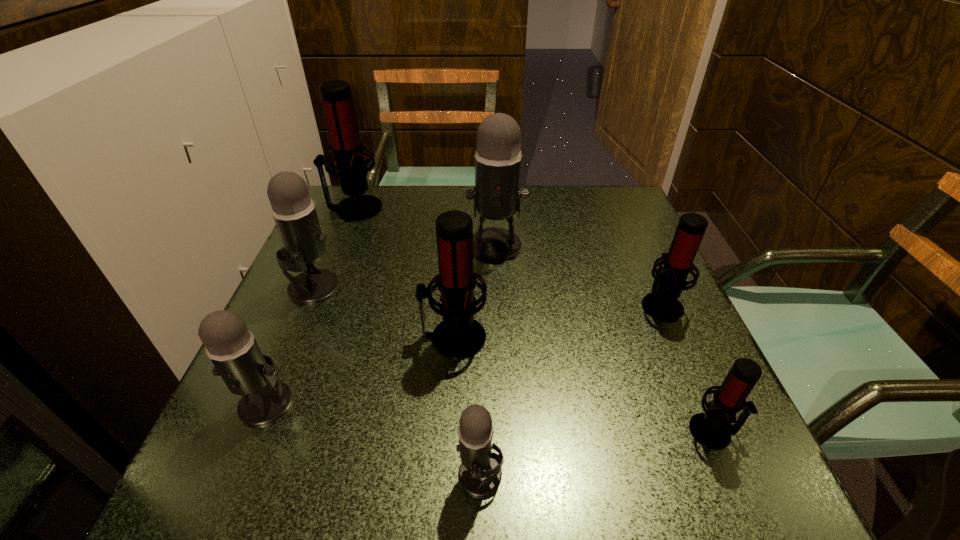
Image resolution: width=960 pixels, height=540 pixels. I want to click on free spot between the second nearest gray microphone and the second biggest red microphone, so click(x=360, y=370).

Locate an element on the screen. This screenshot has height=540, width=960. vacant region between the farthest gray microphone and the third biggest red microphone is located at coordinates (578, 275).

This screenshot has height=540, width=960. In order to click on free space between the nearest gray microphone and the smallest red microphone in this screenshot , I will do `click(597, 453)`.

I want to click on empty space between the nearest gray microphone and the biggest red microphone, so click(x=418, y=342).

You are a GUI agent. You are given a task and a screenshot of the screen. Output one action in this format:
    pyautogui.click(x=<x>, y=<y>)
    Task: Click on the free spot between the biggest red microphone and the farthest gray microphone
    This screenshot has height=540, width=960.
    Given the screenshot: What is the action you would take?
    pyautogui.click(x=425, y=227)

Where is `free area in between the second farthest microphone and the nearest microphone`? The width and height of the screenshot is (960, 540). free area in between the second farthest microphone and the nearest microphone is located at coordinates (488, 360).

Locate which object is the closest to the third smallest red microphone. Please provide its 2D coordinates. Your answer should be formatted as a tuple, i.e. [(x, y)], where the tuple contains the x and y coordinates of a point satisfying the conditions above.

[(496, 194)]

Locate an element on the screen. This screenshot has height=540, width=960. object that is the sixth closest one to the nearest red microphone is located at coordinates (293, 210).

This screenshot has width=960, height=540. Find the location of `microphone that can be found as the closest to the third nearest gray microphone`. microphone that can be found as the closest to the third nearest gray microphone is located at coordinates (231, 346).

Where is `microphone object that ranks as the fourth closest to the second smallest gray microphone`? This screenshot has width=960, height=540. microphone object that ranks as the fourth closest to the second smallest gray microphone is located at coordinates (496, 194).